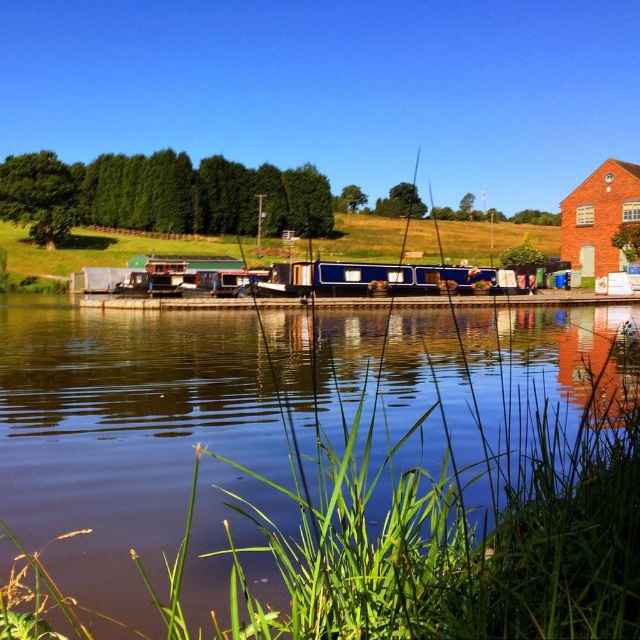
You are a boat operator who needs to navigate a new boat that is 40 feet long into the river. You see the blue glossy water at center and the blue polished wood barge at center. Can you safely maneuver your boat between them without hitting either?

The distance between the blue glossy water at center and the blue polished wood barge at center is 42.70 feet. Since your boat is 40 feet long, you can safely maneuver it between them as there is enough space.

You are standing on the riverside and want to take a photo of the blue glossy water at center and the blue polished wood barge at center. Which one will appear larger in your photo?

The blue glossy water at center appears larger in the photo because it is closer to the viewer than the blue polished wood barge at center.